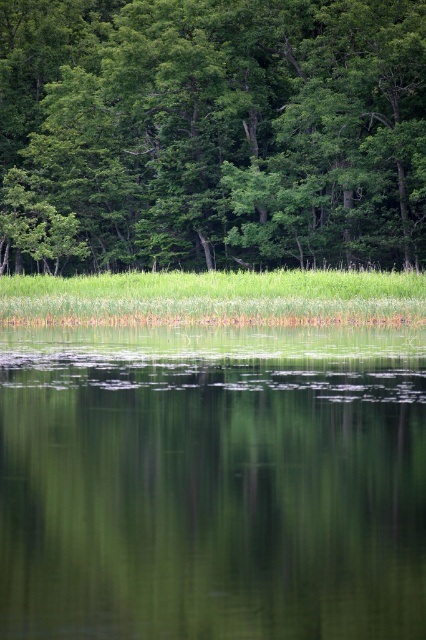
Is point (325, 592) less distant than point (175, 307)?

Yes.

This screenshot has width=426, height=640. Find the location of `green reflective water at center`. green reflective water at center is located at coordinates (212, 483).

What are the coordinates of `green reflective water at center` in the screenshot? It's located at (212, 483).

Can you confirm if green reflective water at center is bigger than green leafy trees at upper center?

Actually, green reflective water at center might be smaller than green leafy trees at upper center.

Is green reflective water at center behind green leafy trees at upper center?

No, it is in front of green leafy trees at upper center.

Does point (356, 557) come farther from viewer compared to point (345, 164)?

That is False.

Where is `green reflective water at center`? Image resolution: width=426 pixels, height=640 pixels. green reflective water at center is located at coordinates (212, 483).

Does green leafy trees at upper center have a greater width compared to green grass at center?

Yes.

Does green leafy trees at upper center have a lesser height compared to green grass at center?

In fact, green leafy trees at upper center may be taller than green grass at center.

Image resolution: width=426 pixels, height=640 pixels. Describe the element at coordinates (212, 134) in the screenshot. I see `green leafy trees at upper center` at that location.

What are the coordinates of `green leafy trees at upper center` in the screenshot? It's located at 212,134.